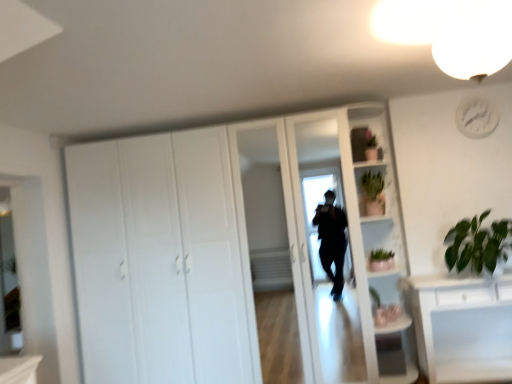
Question: Is green matte cactus at upper right, the second cabinet positioned from the top, to the left of white plastic clock at upper right from the viewer's perspective?

Choices:
 (A) yes
 (B) no

Answer: (A)

Question: Can you confirm if green matte cactus at upper right, the 2th cabinet in the front-to-back sequence, is shorter than white plastic clock at upper right?

Choices:
 (A) no
 (B) yes

Answer: (A)

Question: Is green matte cactus at upper right, the second cabinet positioned from the top, to the right of white plastic clock at upper right from the viewer's perspective?

Choices:
 (A) no
 (B) yes

Answer: (A)

Question: Is green matte cactus at upper right, the second cabinet positioned from the top, closer to camera compared to white plastic clock at upper right?

Choices:
 (A) no
 (B) yes

Answer: (A)

Question: Considering the relative sizes of green matte cactus at upper right, placed as the first cabinet when sorted from bottom to top, and white plastic clock at upper right in the image provided, is green matte cactus at upper right, placed as the first cabinet when sorted from bottom to top, bigger than white plastic clock at upper right?

Choices:
 (A) yes
 (B) no

Answer: (A)

Question: Relative to green matte plant at upper right, the 1th cabinet viewed from the front, is white plastic clock at upper right in front or behind?

Choices:
 (A) behind
 (B) front

Answer: (A)

Question: Do you think white plastic clock at upper right is within green matte plant at upper right, arranged as the 2th cabinet when viewed from the back, or outside of it?

Choices:
 (A) inside
 (B) outside

Answer: (B)

Question: Visually, is white plastic clock at upper right positioned to the left or to the right of green matte plant at upper right, the 1th cabinet viewed from the front?

Choices:
 (A) right
 (B) left

Answer: (A)

Question: From the image's perspective, is white plastic clock at upper right positioned above or below green matte plant at upper right, which is the first cabinet from top to bottom?

Choices:
 (A) below
 (B) above

Answer: (B)

Question: Is white glossy light fixture at upper right situated inside clear glass mirror at left or outside?

Choices:
 (A) outside
 (B) inside

Answer: (A)

Question: In the image, is white glossy light fixture at upper right positioned in front of or behind clear glass mirror at left?

Choices:
 (A) front
 (B) behind

Answer: (A)

Question: From a real-world perspective, is white glossy light fixture at upper right above or below clear glass mirror at left?

Choices:
 (A) below
 (B) above

Answer: (B)

Question: Does point (458, 66) appear closer or farther from the camera than point (0, 268)?

Choices:
 (A) closer
 (B) farther

Answer: (A)

Question: Is point (379, 258) positioned closer to the camera than point (443, 48)?

Choices:
 (A) closer
 (B) farther

Answer: (B)

Question: Is green matte plant at right wider or thinner than white glossy light fixture at upper right?

Choices:
 (A) wide
 (B) thin

Answer: (B)